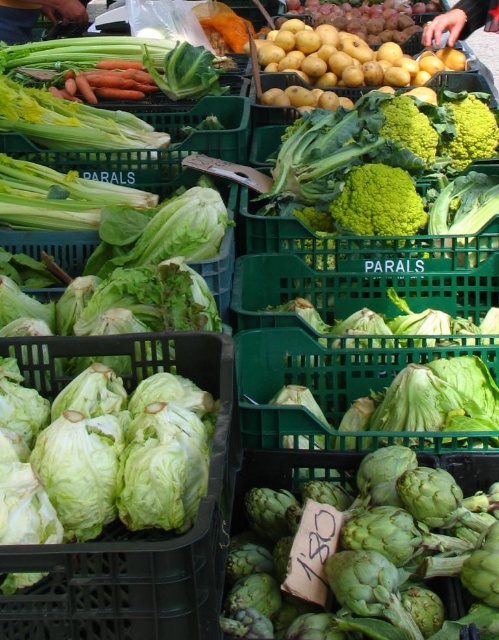
You are a customer at the market stall and want to place the green textured broccoli at upper right into a bag that can only hold items within 1 meter. Can you fit the orange smooth carrots at upper left in the same bag without moving them?

The green textured broccoli at upper right is 1.20 meters away from the orange smooth carrots at upper left. Since the distance exceeds 1 meter, you cannot fit both in the same bag without moving them.

You are a customer at the market stall looking at the green rough artichoke at center and the orange smooth carrots at upper left. Which vegetable is positioned closer to you?

The green rough artichoke at center is closer to the viewer than the orange smooth carrots at upper left.